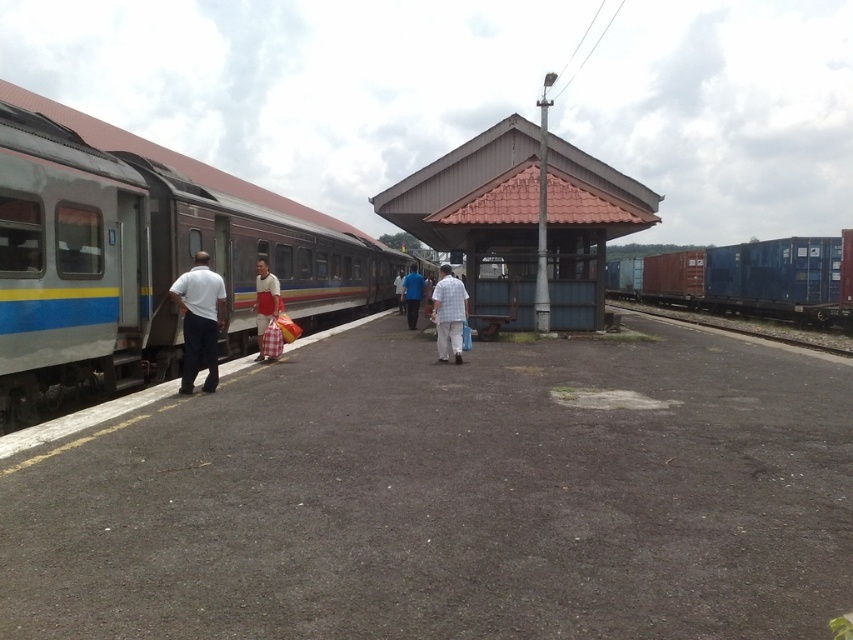
Question: In this image, where is blue matte container at right located relative to blue fabric shirt at center?

Choices:
 (A) right
 (B) left

Answer: (A)

Question: Based on their relative distances, which object is farther from the white checkered shirt at center?

Choices:
 (A) white fabric bag at center
 (B) metallic silver train at left
 (C) white matte shirt at left

Answer: (B)

Question: In this image, where is brown corrugated metal shelter at center located relative to white fabric bag at center?

Choices:
 (A) right
 (B) left

Answer: (A)

Question: Which object is closer to the camera taking this photo?

Choices:
 (A) white matte shirt at left
 (B) metallic silver train at left
 (C) blue fabric bag at center

Answer: (B)

Question: Is metallic silver train at left smaller than blue fabric shirt at center?

Choices:
 (A) yes
 (B) no

Answer: (B)

Question: Among these objects, which one is farthest from the camera?

Choices:
 (A) blue matte container at right
 (B) brown corrugated metal shelter at center
 (C) blue metallic train track at right
 (D) white checkered shirt at center

Answer: (A)